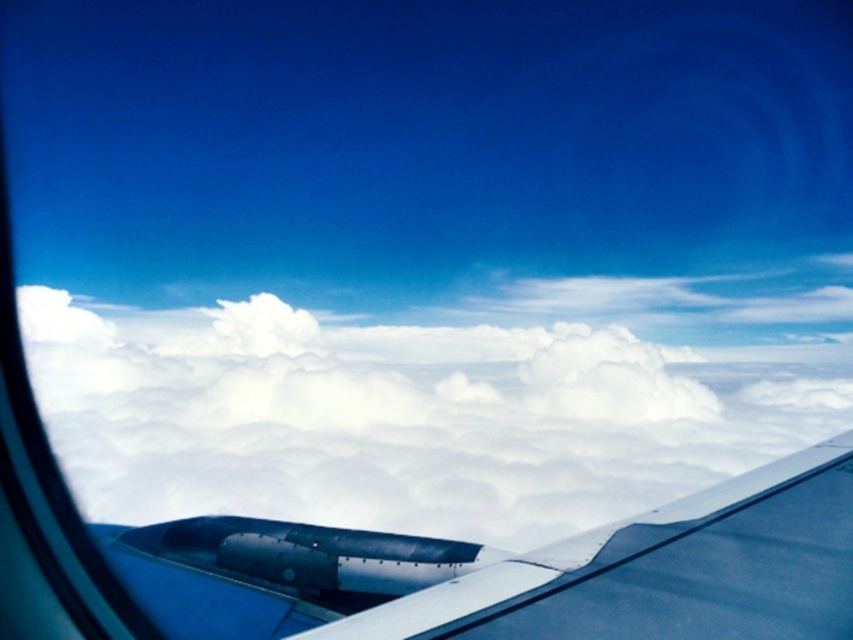
Who is positioned more to the right, white fluffy cloud at center or metallic blue wing at lower right?

white fluffy cloud at center is more to the right.

Is white fluffy cloud at center wider than metallic blue wing at lower right?

Yes.

Is point (579, 506) more distant than point (846, 436)?

Yes, it is.

In order to click on white fluffy cloud at center in this screenshot , I will do `click(405, 417)`.